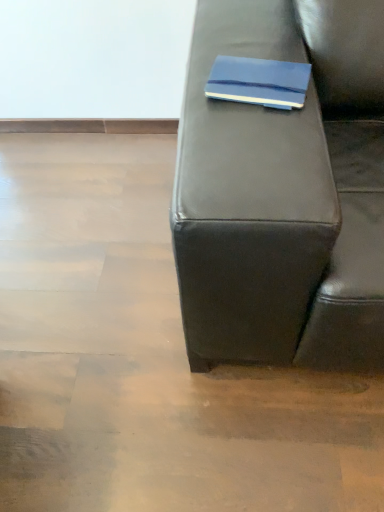
Question: Visually, is blue matte notebook at upper center positioned to the left or to the right of matte black couch at center?

Choices:
 (A) left
 (B) right

Answer: (B)

Question: From a real-world perspective, relative to matte black couch at center, is blue matte notebook at upper center vertically above or below?

Choices:
 (A) above
 (B) below

Answer: (A)

Question: Do you think blue matte notebook at upper center is within matte black couch at center, or outside of it?

Choices:
 (A) outside
 (B) inside

Answer: (A)

Question: Is matte black couch at center bigger or smaller than blue matte notebook at upper center?

Choices:
 (A) small
 (B) big

Answer: (B)

Question: Based on their positions, is matte black couch at center located to the left or right of blue matte notebook at upper center?

Choices:
 (A) right
 (B) left

Answer: (B)

Question: From a real-world perspective, is matte black couch at center physically located above or below blue matte notebook at upper center?

Choices:
 (A) below
 (B) above

Answer: (A)

Question: Is matte black couch at center inside or outside of blue matte notebook at upper center?

Choices:
 (A) outside
 (B) inside

Answer: (A)